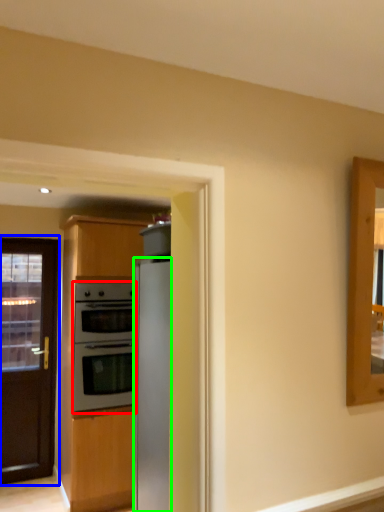
Question: Which object is the farthest from oven (highlighted by a red box)? Choose among these: door (highlighted by a blue box) or refrigerator (highlighted by a green box).

Choices:
 (A) door
 (B) refrigerator

Answer: (B)